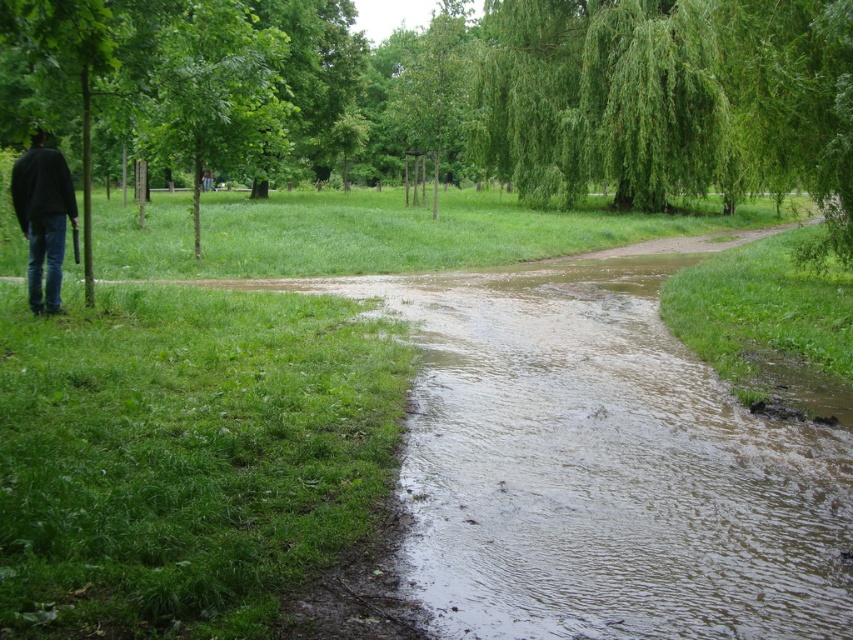
Question: Can you confirm if green leafy tree at left is thinner than black matte jacket at left?

Choices:
 (A) no
 (B) yes

Answer: (A)

Question: Which object appears farthest from the camera in this image?

Choices:
 (A) black matte jacket at left
 (B) green leafy tree at left

Answer: (A)

Question: Is green leafy tree at left behind black matte jacket at left?

Choices:
 (A) yes
 (B) no

Answer: (B)

Question: Which object is closer to the camera taking this photo?

Choices:
 (A) black matte jacket at left
 (B) green leafy tree at left

Answer: (B)

Question: Is green leafy tree at left to the right of black matte jacket at left from the viewer's perspective?

Choices:
 (A) no
 (B) yes

Answer: (B)